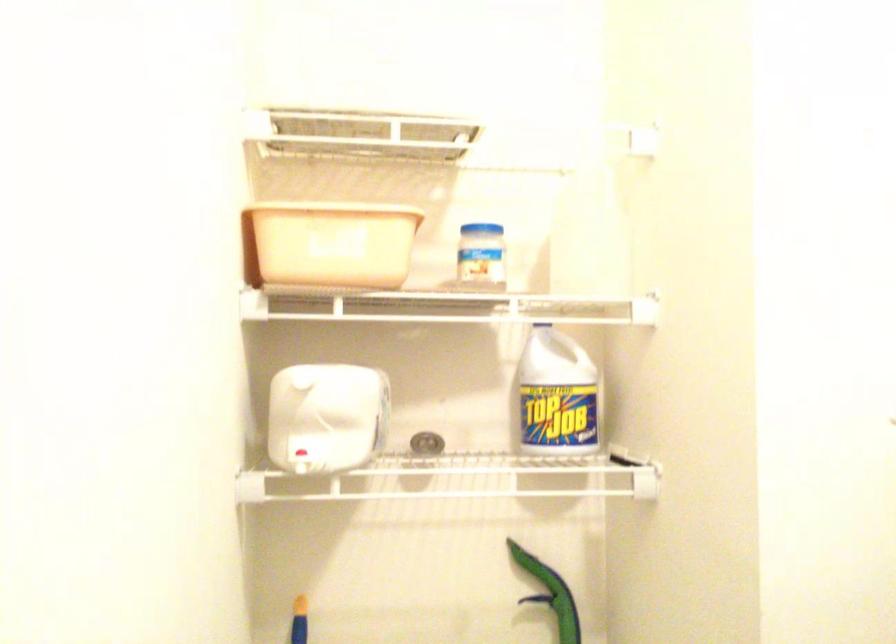
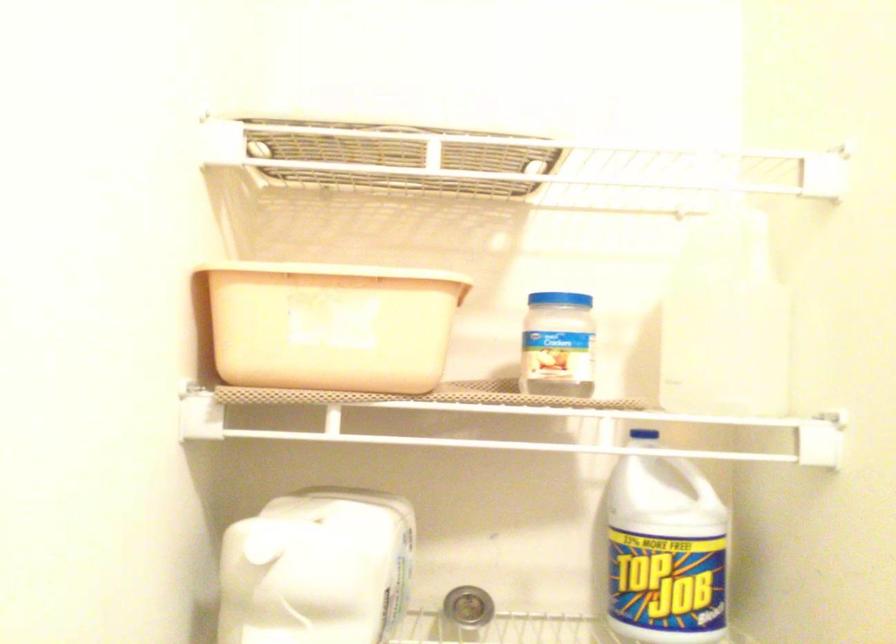
Find the pixel in the second image that matches the point at 319,371 in the first image.

(309, 506)